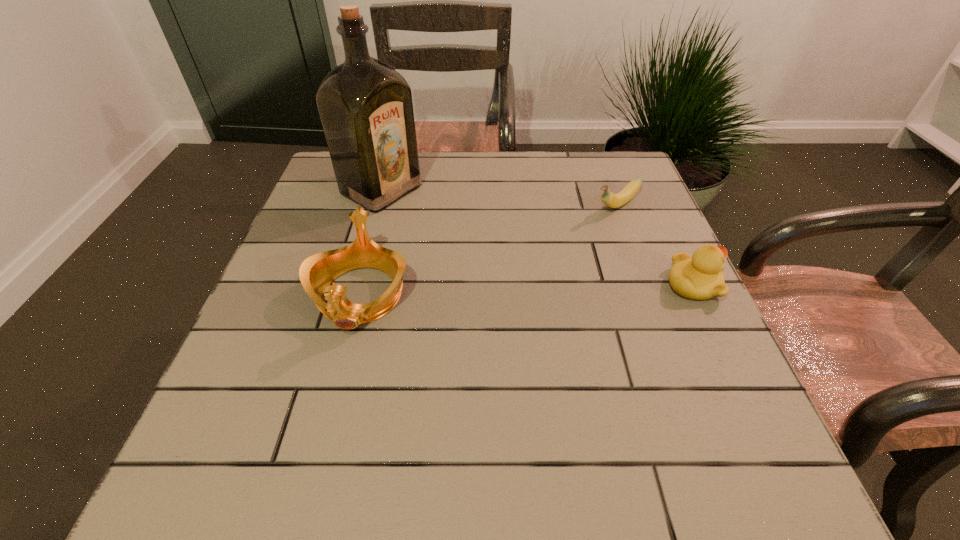
Locate an element on the screen. free space located 0.050m on the label of the liquor is located at coordinates [423, 213].

Locate an element on the screen. banana located at the far edge is located at coordinates (628, 192).

Where is `liquor situated at the far edge`? liquor situated at the far edge is located at coordinates (365, 106).

You are a GUI agent. You are given a task and a screenshot of the screen. Output one action in this format:
    pyautogui.click(x=<x>, y=<y>)
    Task: Click on the tiara at the left edge
    
    Given the screenshot: What is the action you would take?
    pyautogui.click(x=317, y=272)

This screenshot has height=540, width=960. Find the location of `liquor that is at the left edge`. liquor that is at the left edge is located at coordinates (365, 106).

Find the location of a particular element. The image size is (960, 540). duckling present at the right edge is located at coordinates (698, 277).

Find the location of a particular element. The image size is (960, 540). banana that is at the right edge is located at coordinates (628, 192).

Find the location of a particular element. The height and width of the screenshot is (540, 960). object present at the far left corner is located at coordinates (365, 106).

This screenshot has height=540, width=960. Find the location of `object present at the far right corner`. object present at the far right corner is located at coordinates (628, 192).

In the image, there is a desktop. Where is `free space at the far edge`? free space at the far edge is located at coordinates (548, 186).